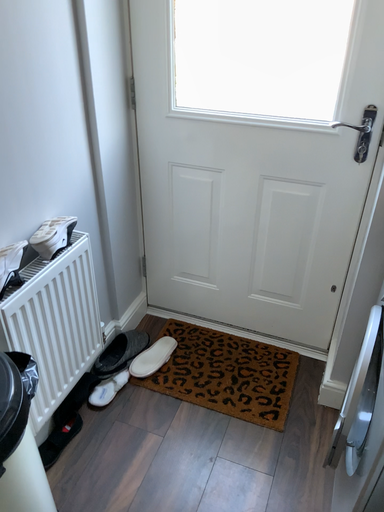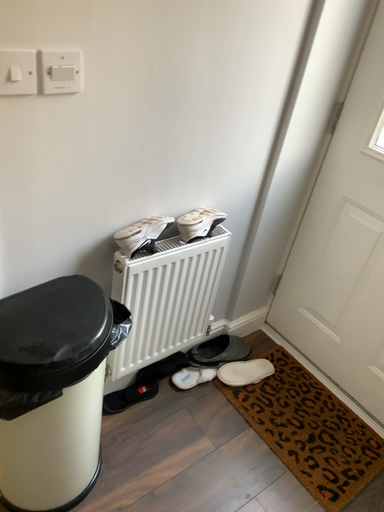
Question: Which way did the camera rotate in the video?

Choices:
 (A) rotated right
 (B) rotated left

Answer: (B)